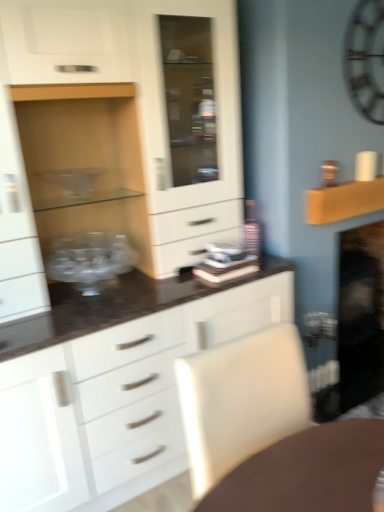
Question: Does wooden shelf at upper right turn towards metallic silver clock at upper right?

Choices:
 (A) yes
 (B) no

Answer: (B)

Question: Is metallic silver clock at upper right completely or partially inside wooden shelf at upper right?

Choices:
 (A) no
 (B) yes

Answer: (A)

Question: Is wooden shelf at upper right closer to the viewer compared to metallic silver clock at upper right?

Choices:
 (A) yes
 (B) no

Answer: (B)

Question: Is metallic silver clock at upper right at the back of wooden shelf at upper right?

Choices:
 (A) yes
 (B) no

Answer: (B)

Question: Is wooden shelf at upper right not inside metallic silver clock at upper right?

Choices:
 (A) yes
 (B) no

Answer: (A)

Question: From a real-world perspective, is wooden shelf at upper right on top of metallic silver clock at upper right?

Choices:
 (A) yes
 (B) no

Answer: (B)

Question: Is white leather swivel chair at lower right facing away from transparent glass bowl at left?

Choices:
 (A) no
 (B) yes

Answer: (B)

Question: Could transparent glass bowl at left be considered to be inside white leather swivel chair at lower right?

Choices:
 (A) no
 (B) yes

Answer: (A)

Question: Is white leather swivel chair at lower right to the right of transparent glass bowl at left from the viewer's perspective?

Choices:
 (A) no
 (B) yes

Answer: (B)

Question: Is white leather swivel chair at lower right bigger than transparent glass bowl at left?

Choices:
 (A) no
 (B) yes

Answer: (B)

Question: From a real-world perspective, is white leather swivel chair at lower right beneath transparent glass bowl at left?

Choices:
 (A) no
 (B) yes

Answer: (B)

Question: Considering the relative sizes of white leather swivel chair at lower right and transparent glass bowl at left in the image provided, is white leather swivel chair at lower right wider than transparent glass bowl at left?

Choices:
 (A) no
 (B) yes

Answer: (B)

Question: Is white leather swivel chair at lower right bigger than wooden shelf at upper right?

Choices:
 (A) yes
 (B) no

Answer: (A)